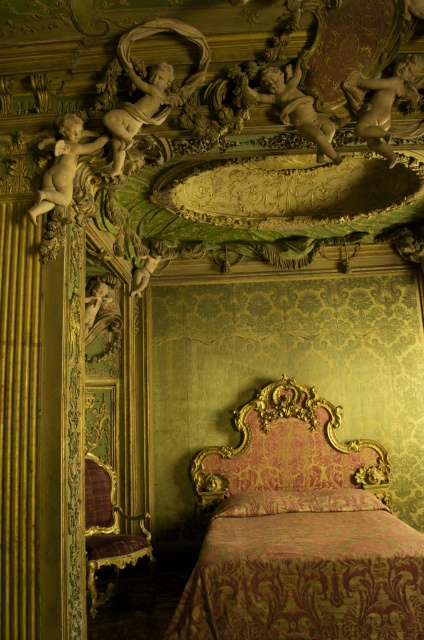
Question: Which object is the closest to the white marble cherub at upper center?

Choices:
 (A) pink damask pillow at center
 (B) matte gold cherub at upper right
 (C) matte white cherub at upper left

Answer: (B)

Question: Does white marble cherub at upper center come in front of matte white cherub at upper left?

Choices:
 (A) yes
 (B) no

Answer: (B)

Question: In this image, where is gold ornate headboard at center located relative to white marble cherub at upper center?

Choices:
 (A) above
 (B) below

Answer: (B)

Question: Which point is farther from the camera taking this photo?

Choices:
 (A) (262, 496)
 (B) (278, 392)
 (C) (349, 81)

Answer: (B)

Question: Does matte gold cherub at upper left have a larger size compared to matte white cherub at upper left?

Choices:
 (A) yes
 (B) no

Answer: (A)

Question: Which object appears farthest from the camera in this image?

Choices:
 (A) pink damask pillow at center
 (B) white marble cherub at upper center
 (C) matte white cherub at upper left

Answer: (A)